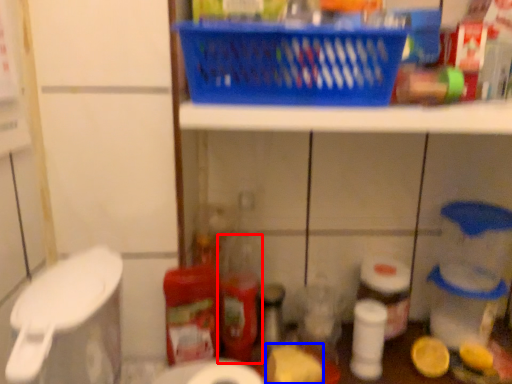
Question: Which object is further to the camera taking this photo, bottle (highlighted by a red box) or food (highlighted by a blue box)?

Choices:
 (A) bottle
 (B) food

Answer: (A)